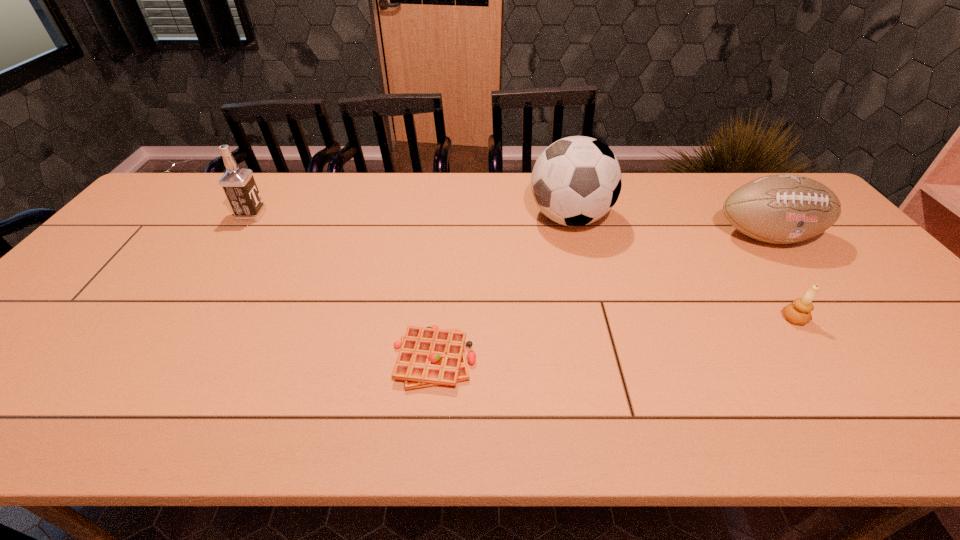
The height and width of the screenshot is (540, 960). I want to click on soccer ball, so click(575, 181).

The height and width of the screenshot is (540, 960). Find the location of `vodka`. vodka is located at coordinates [x=239, y=186].

The height and width of the screenshot is (540, 960). Find the location of `football (American)`. football (American) is located at coordinates (781, 209).

Where is `candle_holder`? candle_holder is located at coordinates (799, 312).

The height and width of the screenshot is (540, 960). In order to click on the fourth tallest object in this screenshot , I will do `click(799, 312)`.

Image resolution: width=960 pixels, height=540 pixels. Identify the location of the fourth object from right to left. (430, 356).

Locate an element on the screen. the nearest object is located at coordinates (430, 356).

Find the location of a particular element. This screenshot has height=540, width=960. vacant region located on the main logo of the third object from left to right is located at coordinates (410, 218).

Find the location of a particular element. The height and width of the screenshot is (540, 960). free space located 0.150m on the main logo of the third object from left to right is located at coordinates (480, 218).

You are a GUI agent. You are given a task and a screenshot of the screen. Output one action in this format:
    pyautogui.click(x=<x>, y=<y>)
    Task: Click on the free space located on the main logo of the third object from left to right
    
    Given the screenshot: What is the action you would take?
    pyautogui.click(x=403, y=218)